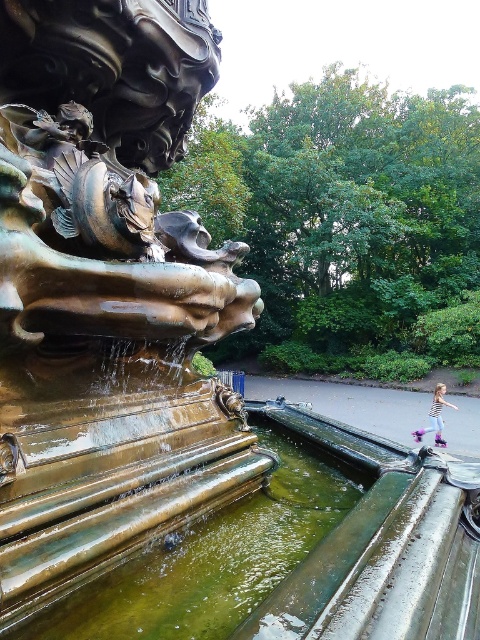
In the scene shown: Is green metallic water at lower left to the right of striped t-shirt at lower right from the viewer's perspective?

In fact, green metallic water at lower left is to the left of striped t-shirt at lower right.

Does green metallic water at lower left have a lesser width compared to striped t-shirt at lower right?

In fact, green metallic water at lower left might be wider than striped t-shirt at lower right.

Between point (266, 582) and point (440, 444), which one is positioned in front?

Point (266, 582) is more forward.

Where is `green metallic water at lower left`? green metallic water at lower left is located at coordinates (214, 556).